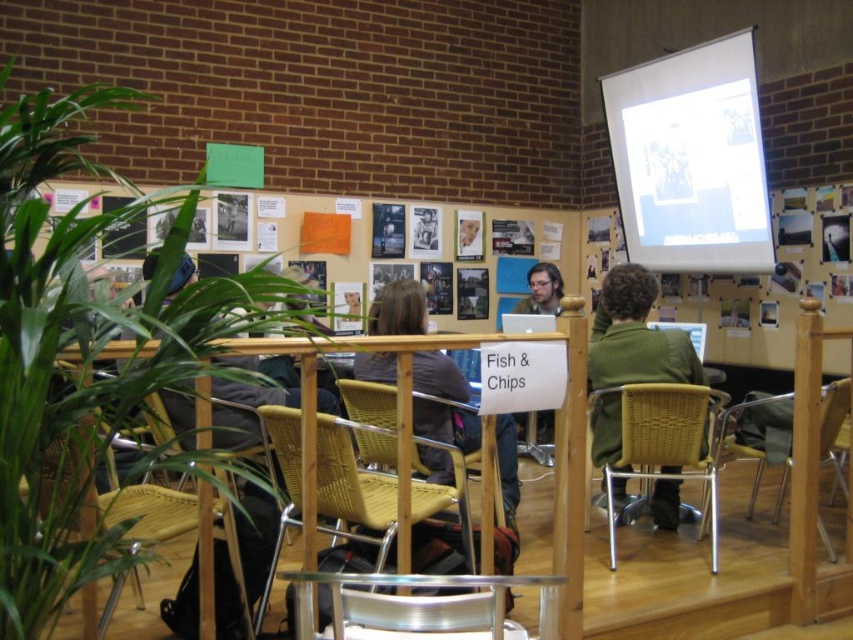
Question: Among these objects, which one is nearest to the camera?

Choices:
 (A) white paper at upper center
 (B) dark brown leather jacket at center

Answer: (B)

Question: Does white matte projection screen at upper right have a greater width compared to woven wicker chair at lower left?

Choices:
 (A) no
 (B) yes

Answer: (B)

Question: Which of the following is the farthest from the observer?

Choices:
 (A) (347, 637)
 (B) (743, 416)
 (C) (763, 304)
 (D) (380, 564)

Answer: (C)

Question: Can you confirm if clear plastic chair at lower center is positioned to the left of woven plastic chair at center?

Choices:
 (A) yes
 (B) no

Answer: (B)

Question: Which object appears farthest from the camera in this image?

Choices:
 (A) woven wicker chair at lower left
 (B) clear plastic chair at lower center
 (C) woven wood chair at center
 (D) woven wicker chair at lower right

Answer: (C)

Question: Is woven wicker chair at lower right to the right of woven wicker chair at lower left from the viewer's perspective?

Choices:
 (A) no
 (B) yes

Answer: (B)